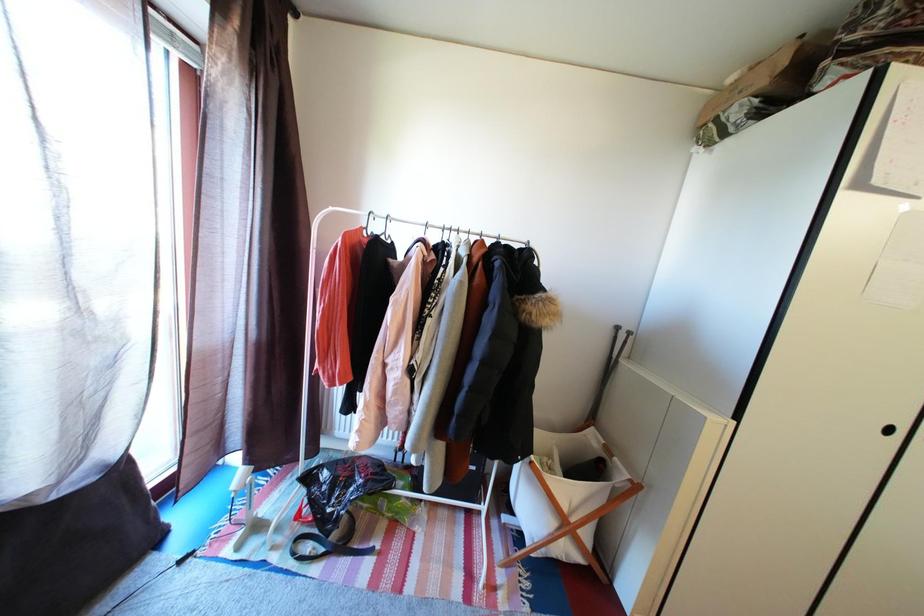
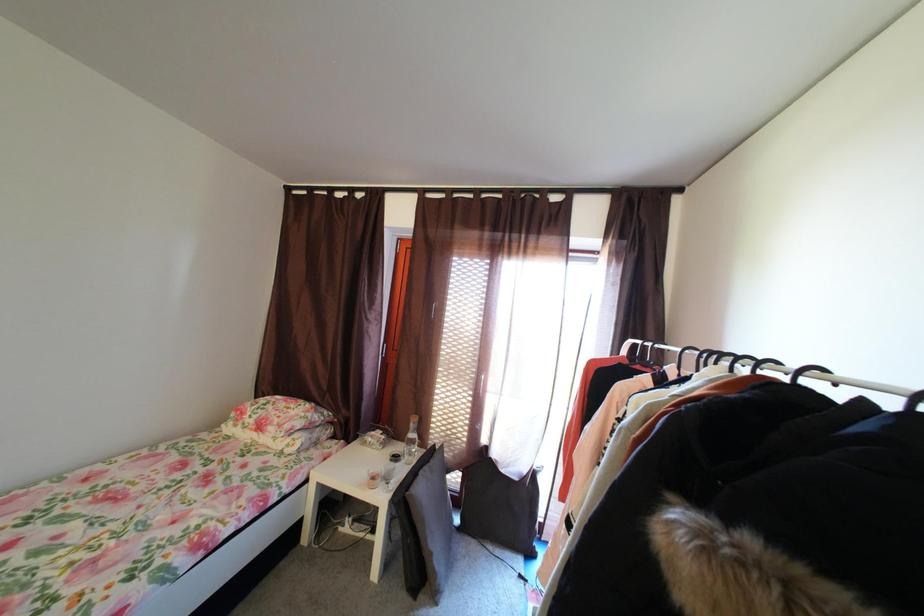
Question: The camera is either moving clockwise (left) or counter-clockwise (right) around the object. The first image is from the beginning of the video and the second image is from the end. Is the camera moving left or right when shooting the video?

Choices:
 (A) Left
 (B) Right

Answer: (B)